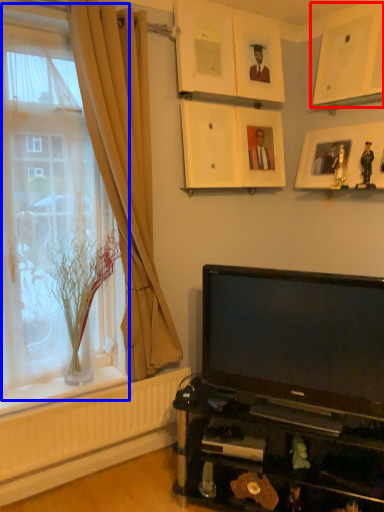
Question: Which point is closer to the camera, picture frame (highlighted by a red box) or window (highlighted by a blue box)?

Choices:
 (A) picture frame
 (B) window

Answer: (B)